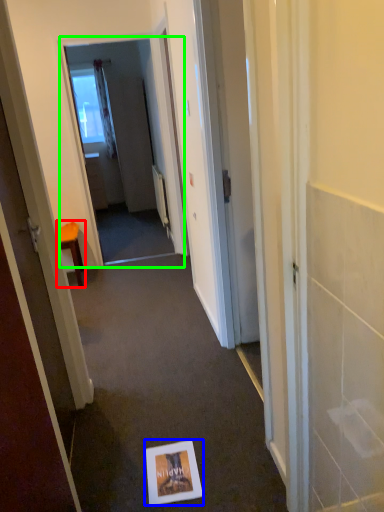
Question: Which object is the closest to the furniture (highlighted by a red box)? Choose among these: postcard (highlighted by a blue box) or screen door (highlighted by a green box).

Choices:
 (A) postcard
 (B) screen door

Answer: (B)